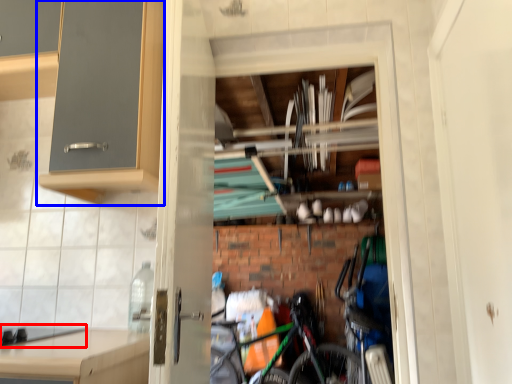
Question: Which of the following is the farthest to the observer, gas stove (highlighted by a red box) or cabinetry (highlighted by a blue box)?

Choices:
 (A) gas stove
 (B) cabinetry

Answer: (B)